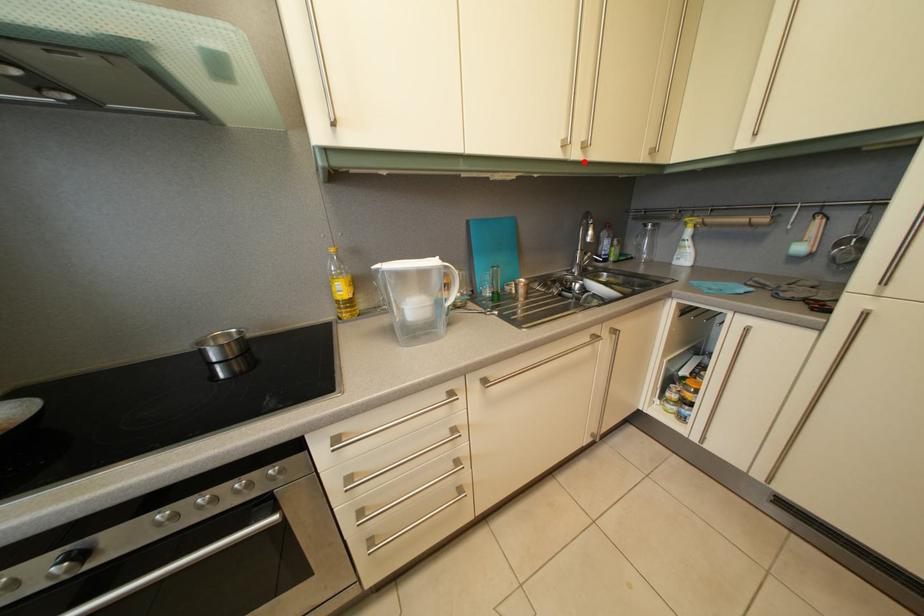
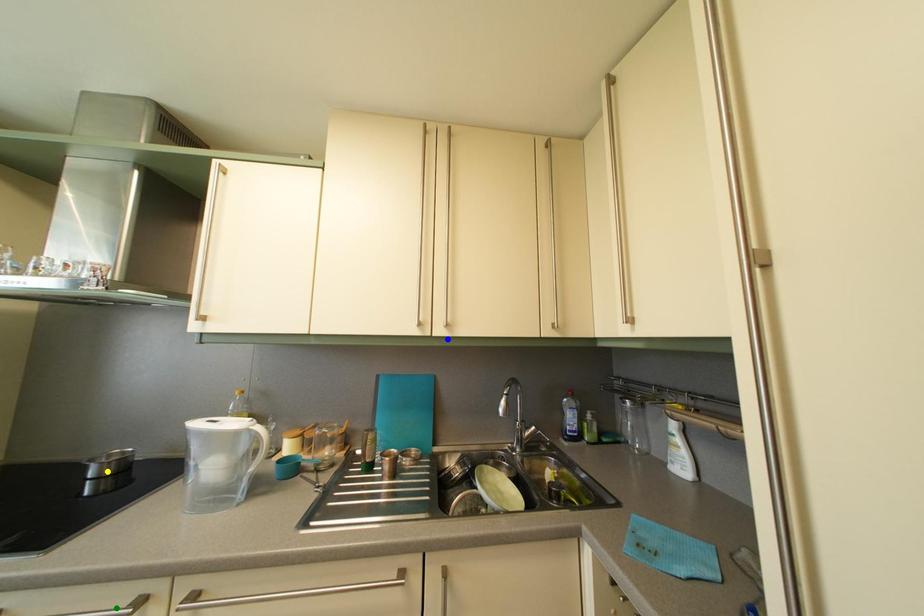
Question: I am providing you with two images of the same scene from different viewpoints. A red point is marked on the first image. You are given multiple points on the second image. Can you choose the point in image 2 that corresponds to the point in image 1?

Choices:
 (A) green point
 (B) yellow point
 (C) blue point

Answer: (C)